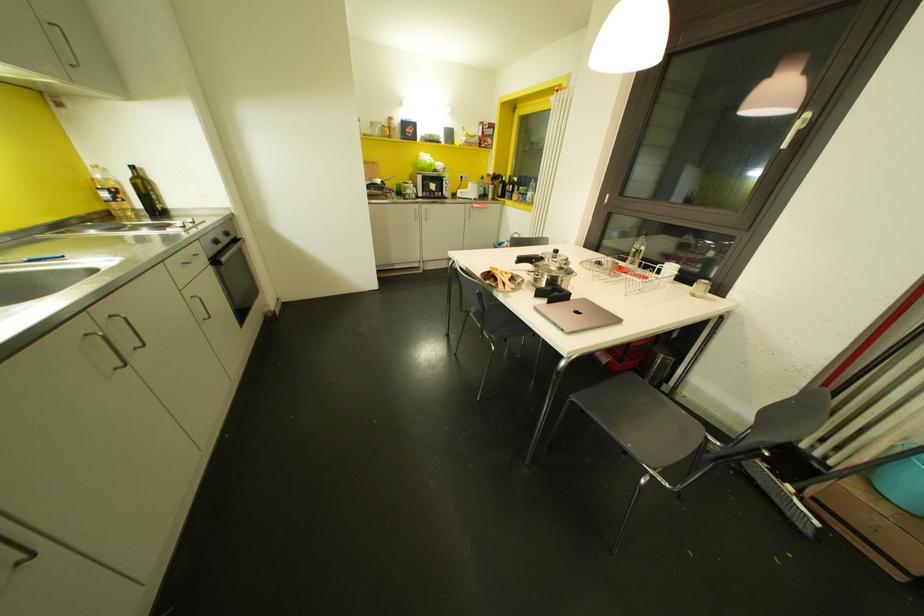
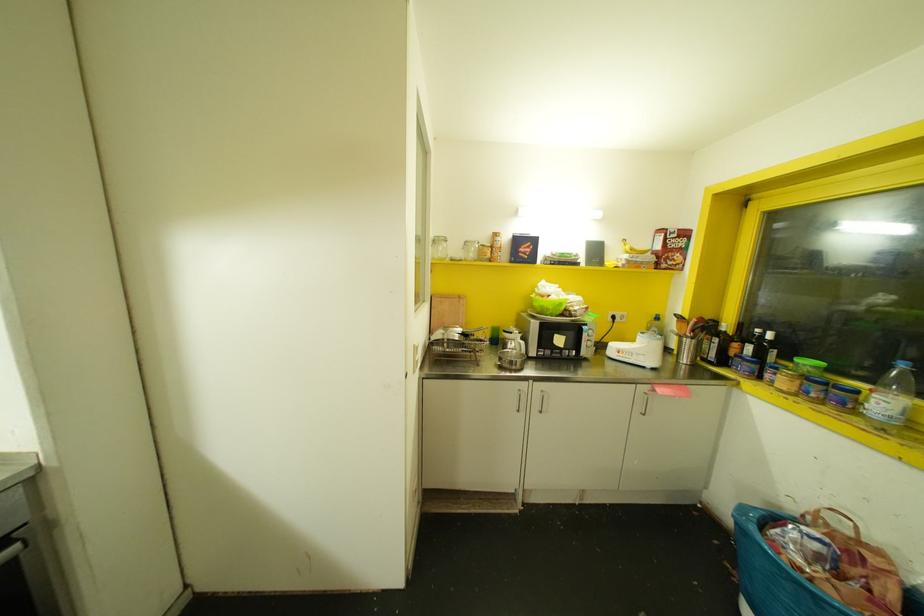
Where in the second image is the point corresponding to [503,195] from the first image?

(723, 361)